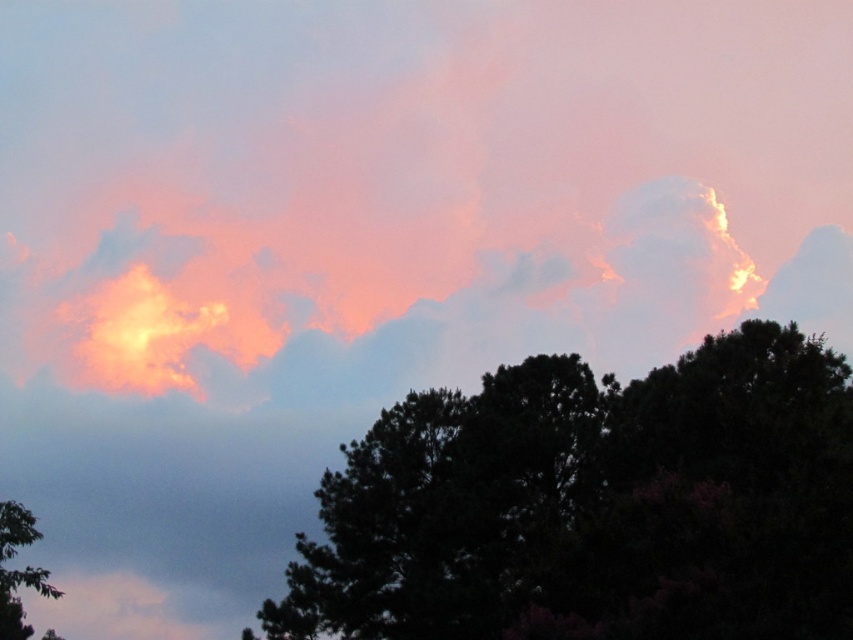
Question: Can you confirm if dark green leafy tree at center is positioned below green leafy tree at lower left?

Choices:
 (A) no
 (B) yes

Answer: (A)

Question: Can you confirm if dark green leafy tree at center is positioned below green leafy tree at lower left?

Choices:
 (A) no
 (B) yes

Answer: (A)

Question: Does dark green leafy tree at center appear on the right side of green leafy tree at lower left?

Choices:
 (A) yes
 (B) no

Answer: (A)